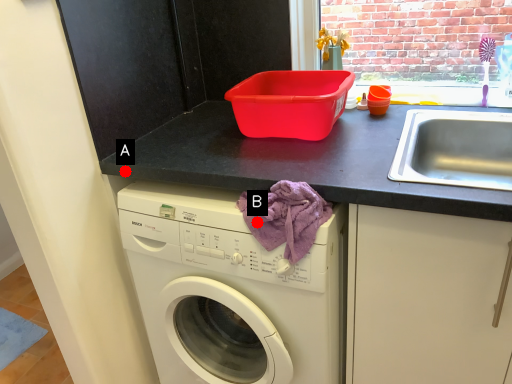
Question: Two points are circled on the image, labeled by A and B beside each circle. Which point is closer to the camera?

Choices:
 (A) A is closer
 (B) B is closer

Answer: (B)